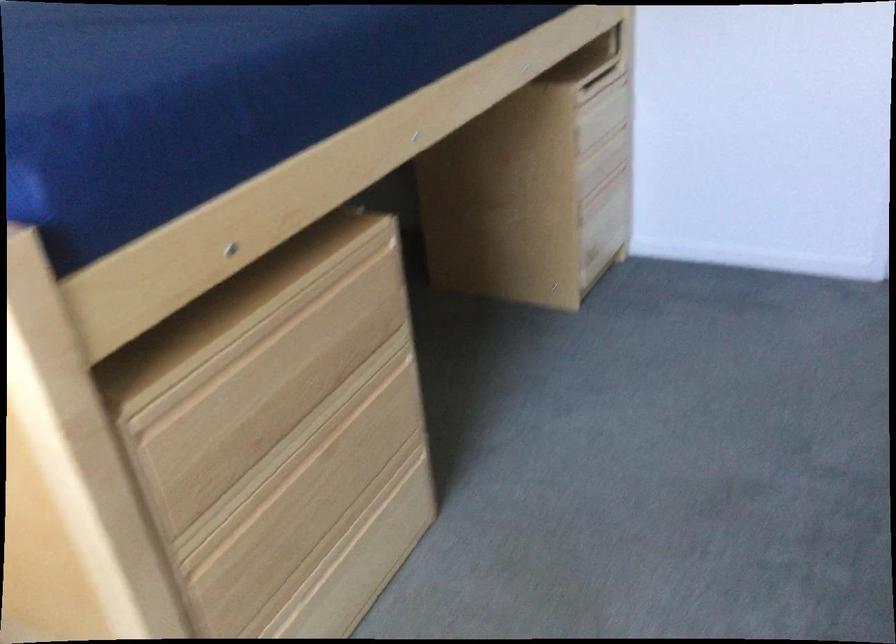
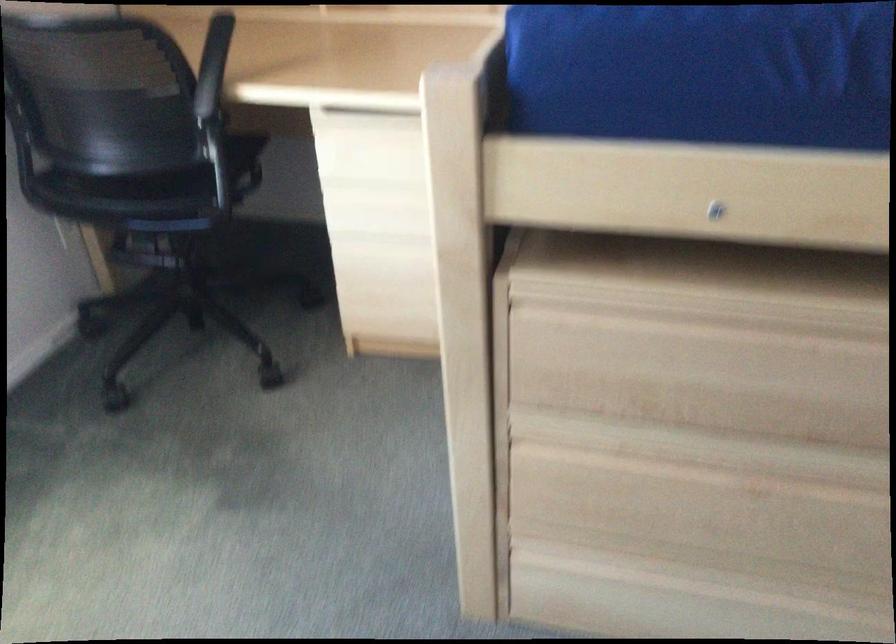
The point at (x=246, y=346) is marked in the first image. Where is the corresponding point in the second image?

(711, 321)